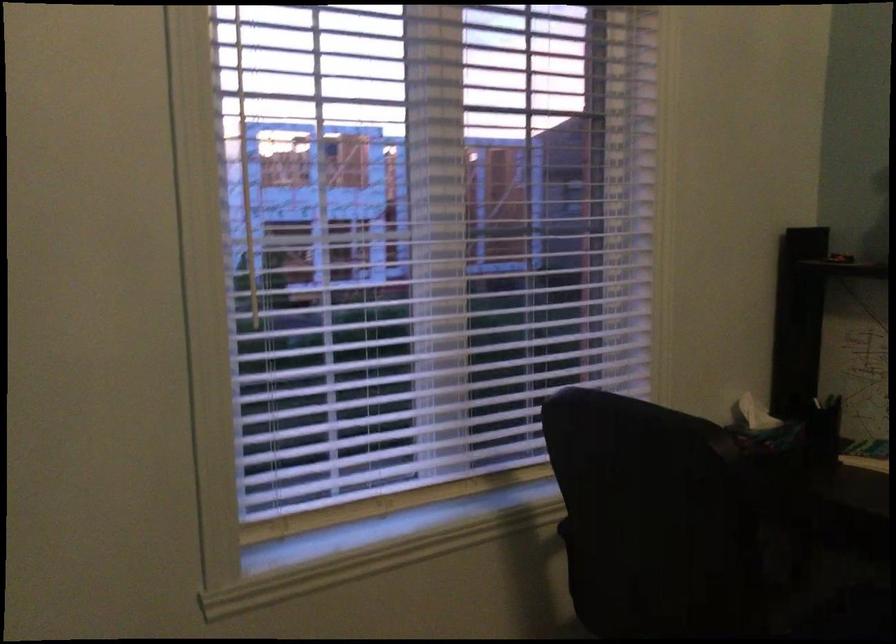
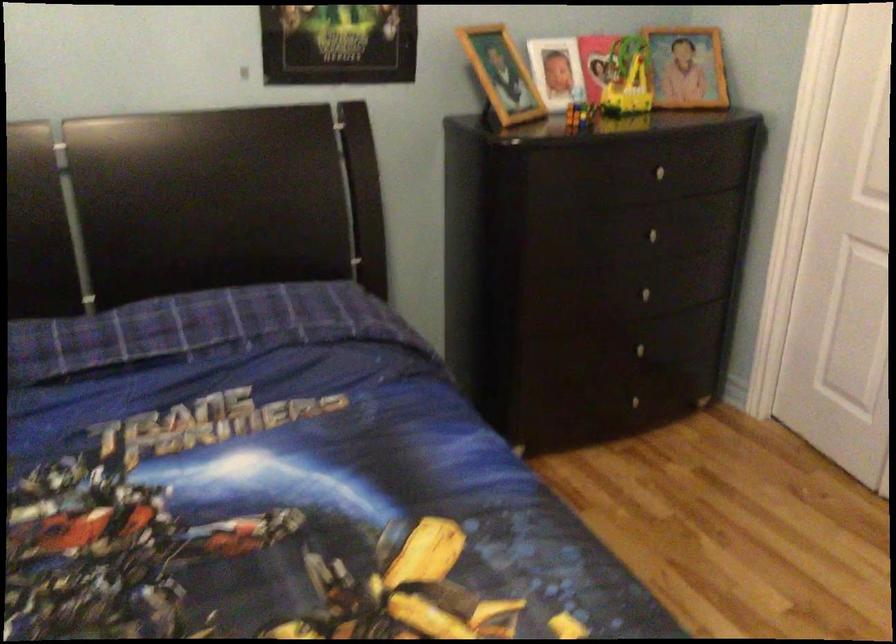
Based on the continuous images, in which direction is the camera rotating?

The camera's rotation is toward right-down.